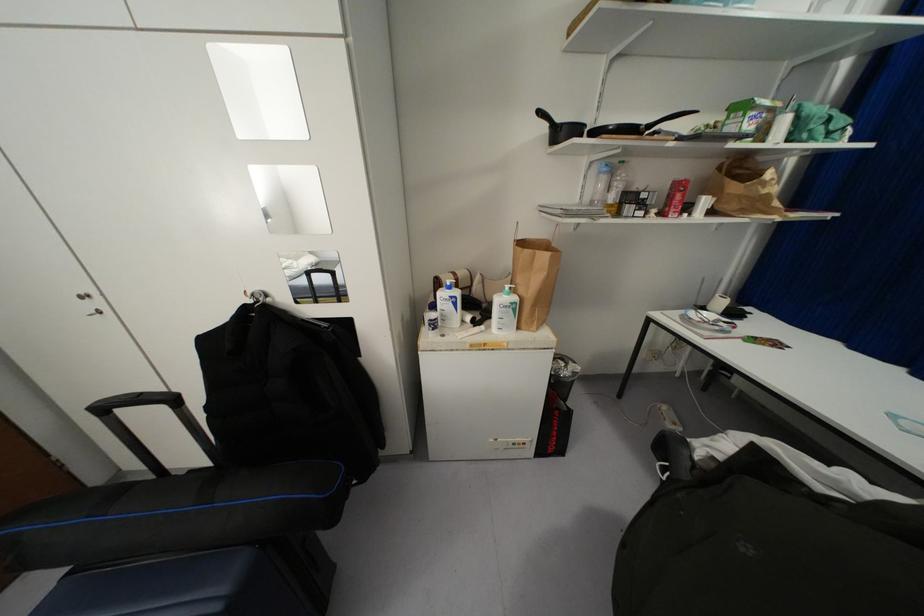
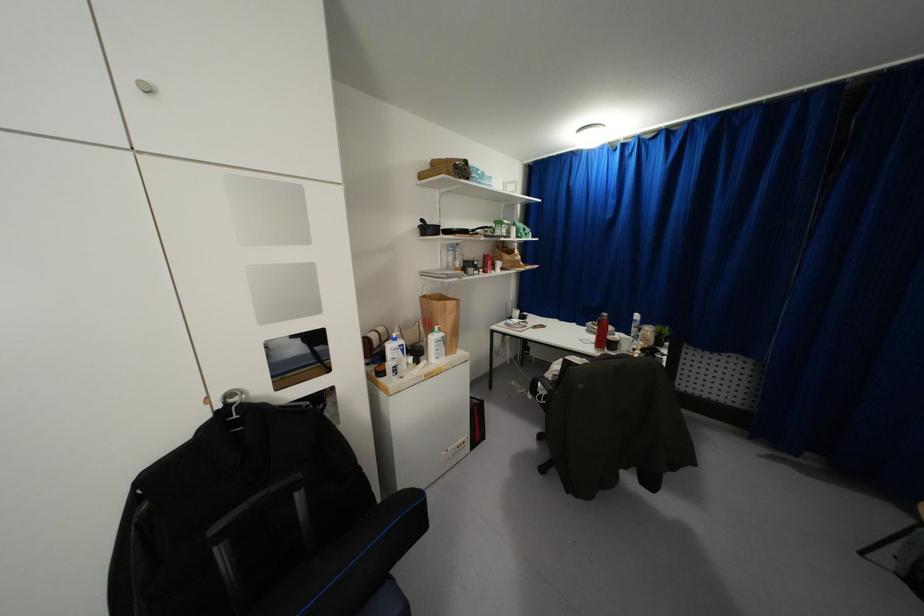
Locate, in the second image, the point that corresponds to [598,172] in the first image.

(446, 249)